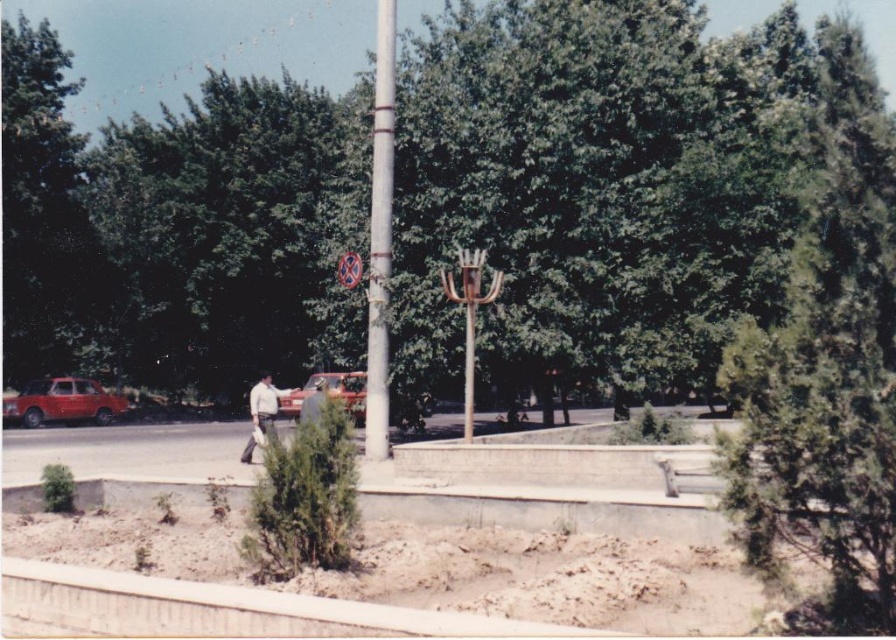
Question: Is green leafy tree at center positioned behind metallic pole at center?

Choices:
 (A) no
 (B) yes

Answer: (A)

Question: Does matte red car at left have a greater width compared to metallic reflective sign at center?

Choices:
 (A) no
 (B) yes

Answer: (B)

Question: Which object is the closest to the metallic pole at center?

Choices:
 (A) white metallic pole at center
 (B) metallic red car at center
 (C) metallic reflective sign at center
 (D) gray fabric jacket at center

Answer: (C)

Question: Estimate the real-world distances between objects in this image. Which object is closer to the green leafy tree at center?

Choices:
 (A) white cotton shirt at center
 (B) metallic reflective sign at center
 (C) metallic red car at center
 (D) white metallic pole at center

Answer: (D)

Question: Which of the following is the closest to the observer?

Choices:
 (A) (346, 252)
 (B) (785, 310)
 (C) (466, 412)

Answer: (C)

Question: Can you confirm if matte red car at left is bigger than white cotton shirt at center?

Choices:
 (A) yes
 (B) no

Answer: (B)